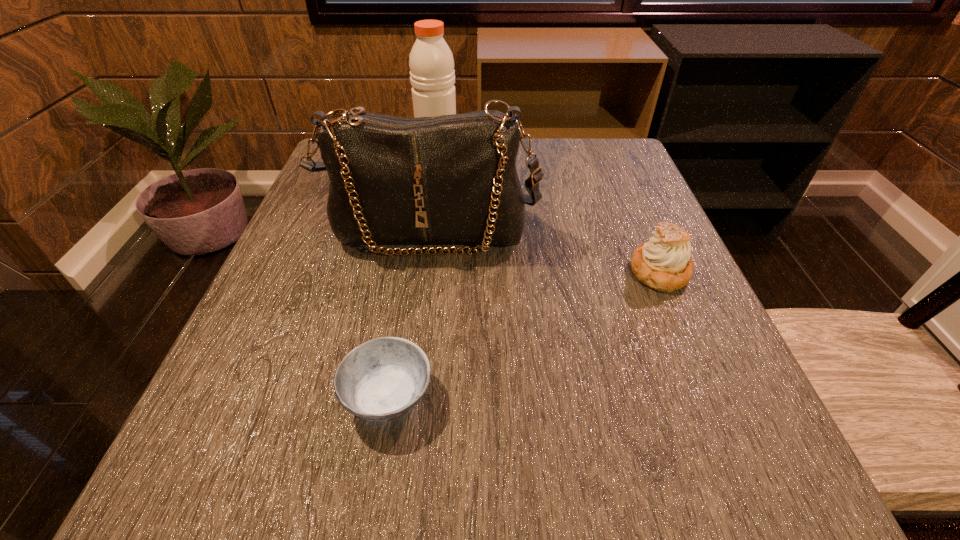
This screenshot has width=960, height=540. Find the location of `the farthest object`. the farthest object is located at coordinates (432, 75).

Where is `handbag`? handbag is located at coordinates (446, 179).

In order to click on the second shortest object in this screenshot , I will do `click(663, 263)`.

This screenshot has height=540, width=960. Identify the location of the rightmost object. (663, 263).

Locate an element on the screen. the nearest object is located at coordinates (381, 380).

The width and height of the screenshot is (960, 540). Identify the location of ashtray. click(381, 380).

Image resolution: width=960 pixels, height=540 pixels. What are the coordinates of `vacant space located on the right of the farthest object` in the screenshot? It's located at (552, 154).

This screenshot has height=540, width=960. Identify the location of free space located 0.140m at the front of the handbag with chain and zipper. (418, 323).

Identify the location of free space located 0.080m on the front of the rightmost object. The width and height of the screenshot is (960, 540). (684, 332).

The height and width of the screenshot is (540, 960). In order to click on free space located 0.350m on the back of the shortest object in this screenshot , I will do `click(419, 217)`.